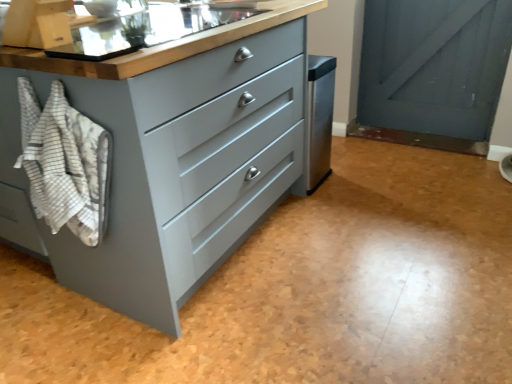
Question: Is white striped towel at left thinner than matte stainless steel sink at upper center?

Choices:
 (A) no
 (B) yes

Answer: (B)

Question: Can you confirm if white striped towel at left is shorter than matte stainless steel sink at upper center?

Choices:
 (A) yes
 (B) no

Answer: (B)

Question: Is white striped towel at left far from matte stainless steel sink at upper center?

Choices:
 (A) no
 (B) yes

Answer: (A)

Question: From the image's perspective, is white striped towel at left located above matte stainless steel sink at upper center?

Choices:
 (A) yes
 (B) no

Answer: (B)

Question: From a real-world perspective, is white striped towel at left below matte stainless steel sink at upper center?

Choices:
 (A) no
 (B) yes

Answer: (B)

Question: Can we say white striped towel at left lies outside matte stainless steel sink at upper center?

Choices:
 (A) no
 (B) yes

Answer: (B)

Question: Is matte stainless steel sink at upper center far from matte gray chest of drawers at center?

Choices:
 (A) yes
 (B) no

Answer: (B)

Question: From the image's perspective, is matte stainless steel sink at upper center located beneath matte gray chest of drawers at center?

Choices:
 (A) yes
 (B) no

Answer: (B)

Question: From a real-world perspective, is matte stainless steel sink at upper center located beneath matte gray chest of drawers at center?

Choices:
 (A) no
 (B) yes

Answer: (A)

Question: Is matte stainless steel sink at upper center turned away from matte gray chest of drawers at center?

Choices:
 (A) yes
 (B) no

Answer: (A)

Question: Would you say matte stainless steel sink at upper center is outside matte gray chest of drawers at center?

Choices:
 (A) yes
 (B) no

Answer: (B)

Question: From a real-world perspective, is matte stainless steel sink at upper center located higher than matte gray chest of drawers at center?

Choices:
 (A) no
 (B) yes

Answer: (B)

Question: Does white striped towel at left appear on the right side of matte gray chest of drawers at center?

Choices:
 (A) no
 (B) yes

Answer: (A)